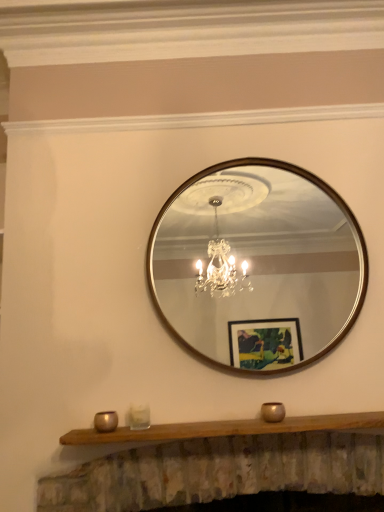
This screenshot has width=384, height=512. What are the coordinates of `clear glass candle holder at lower center, which is counted as the 2th candle holder, starting from the right` in the screenshot? It's located at (139, 417).

What do you see at coordinates (257, 266) in the screenshot? This screenshot has height=512, width=384. I see `wooden-framed mirror at center` at bounding box center [257, 266].

This screenshot has height=512, width=384. Find the location of `gold metallic candle holder at lower center, the first candle holder when ordered from right to left`. gold metallic candle holder at lower center, the first candle holder when ordered from right to left is located at coordinates tap(273, 412).

What is the approximate height of wooden mantle at center?

1.50 inches.

Where is `clear glass candle holder at lower center, which appears as the second candle holder when viewed from the left`? The image size is (384, 512). clear glass candle holder at lower center, which appears as the second candle holder when viewed from the left is located at coordinates (139, 417).

Looking at this image, between wooden mantle at center and gold metallic candle holder at lower center, marked as the third candle holder in a left-to-right arrangement, which one has larger size?

Bigger between the two is wooden mantle at center.

How different are the orientations of wooden mantle at center and gold metallic candle holder at lower center, marked as the third candle holder in a left-to-right arrangement, in degrees?

0.375 degrees.

Does wooden mantle at center have a lesser height compared to gold metallic candle holder at lower center, the first candle holder when ordered from right to left?

Indeed, wooden mantle at center has a lesser height compared to gold metallic candle holder at lower center, the first candle holder when ordered from right to left.

Is wooden mantle at center completely or partially outside of gold metallic candle holder at lower center, the first candle holder when ordered from right to left?

Indeed, wooden mantle at center is completely outside gold metallic candle holder at lower center, the first candle holder when ordered from right to left.

Looking at this image, which of these two, metallic gold candle holder at lower center, arranged as the third candle holder when viewed from the right, or clear glass candle holder at lower center, which appears as the second candle holder when viewed from the left, stands taller?

With more height is clear glass candle holder at lower center, which appears as the second candle holder when viewed from the left.

Is metallic gold candle holder at lower center, arranged as the third candle holder when viewed from the right, completely or partially outside of clear glass candle holder at lower center, which is counted as the 2th candle holder, starting from the right?

Yes, metallic gold candle holder at lower center, arranged as the third candle holder when viewed from the right, is not within clear glass candle holder at lower center, which is counted as the 2th candle holder, starting from the right.

Which object is closer to the camera, metallic gold candle holder at lower center, which is the 1th candle holder in left-to-right order, or clear glass candle holder at lower center, which appears as the second candle holder when viewed from the left?

metallic gold candle holder at lower center, which is the 1th candle holder in left-to-right order.

Is metallic gold candle holder at lower center, which is the 1th candle holder in left-to-right order, aimed at clear glass candle holder at lower center, which is counted as the 2th candle holder, starting from the right?

No, metallic gold candle holder at lower center, which is the 1th candle holder in left-to-right order, is not turned towards clear glass candle holder at lower center, which is counted as the 2th candle holder, starting from the right.

How many degrees apart are the facing directions of clear glass candle holder at lower center, which appears as the second candle holder when viewed from the left, and metallic gold candle holder at lower center, which is the 1th candle holder in left-to-right order?

There is a 1.3-degree angle between the facing directions of clear glass candle holder at lower center, which appears as the second candle holder when viewed from the left, and metallic gold candle holder at lower center, which is the 1th candle holder in left-to-right order.

From a real-world perspective, which is physically above, clear glass candle holder at lower center, which appears as the second candle holder when viewed from the left, or metallic gold candle holder at lower center, which is the 1th candle holder in left-to-right order?

clear glass candle holder at lower center, which appears as the second candle holder when viewed from the left.

Is clear glass candle holder at lower center, which appears as the second candle holder when viewed from the left, further to camera compared to metallic gold candle holder at lower center, which is the 1th candle holder in left-to-right order?

That is True.

Measure the distance between clear glass candle holder at lower center, which is counted as the 2th candle holder, starting from the right, and metallic gold candle holder at lower center, arranged as the third candle holder when viewed from the right.

The distance of clear glass candle holder at lower center, which is counted as the 2th candle holder, starting from the right, from metallic gold candle holder at lower center, arranged as the third candle holder when viewed from the right, is 3.14 inches.

Is wooden mantle at center directly adjacent to metallic gold candle holder at lower center, which is the 1th candle holder in left-to-right order?

wooden mantle at center and metallic gold candle holder at lower center, which is the 1th candle holder in left-to-right order, are clearly separated.

Is point (129, 437) closer to camera compared to point (108, 425)?

Yes, point (129, 437) is closer to viewer.

From a real-world perspective, which is physically below, wooden mantle at center or metallic gold candle holder at lower center, which is the 1th candle holder in left-to-right order?

wooden mantle at center.

Can you confirm if wooden mantle at center is shorter than metallic gold candle holder at lower center, which is the 1th candle holder in left-to-right order?

Yes.

Who is taller, metallic gold candle holder at lower center, arranged as the third candle holder when viewed from the right, or wooden-framed mirror at center?

Standing taller between the two is wooden-framed mirror at center.

Can you tell me how much metallic gold candle holder at lower center, which is the 1th candle holder in left-to-right order, and wooden-framed mirror at center differ in facing direction?

1.58 degrees separate the facing orientations of metallic gold candle holder at lower center, which is the 1th candle holder in left-to-right order, and wooden-framed mirror at center.

From the image's perspective, is metallic gold candle holder at lower center, which is the 1th candle holder in left-to-right order, on top of wooden-framed mirror at center?

No.

Can wooden-framed mirror at center be found inside metallic gold candle holder at lower center, which is the 1th candle holder in left-to-right order?

Definitely not — wooden-framed mirror at center is not inside metallic gold candle holder at lower center, which is the 1th candle holder in left-to-right order.

From the image's perspective, which object appears higher, gold metallic candle holder at lower center, the first candle holder when ordered from right to left, or metallic gold candle holder at lower center, which is the 1th candle holder in left-to-right order?

gold metallic candle holder at lower center, the first candle holder when ordered from right to left.

Is gold metallic candle holder at lower center, marked as the third candle holder in a left-to-right arrangement, not close to metallic gold candle holder at lower center, which is the 1th candle holder in left-to-right order?

gold metallic candle holder at lower center, marked as the third candle holder in a left-to-right arrangement, is actually quite close to metallic gold candle holder at lower center, which is the 1th candle holder in left-to-right order.

Is gold metallic candle holder at lower center, the first candle holder when ordered from right to left, not within metallic gold candle holder at lower center, arranged as the third candle holder when viewed from the right?

Yes, gold metallic candle holder at lower center, the first candle holder when ordered from right to left, is outside of metallic gold candle holder at lower center, arranged as the third candle holder when viewed from the right.

Considering the sizes of objects clear glass candle holder at lower center, which appears as the second candle holder when viewed from the left, and gold metallic candle holder at lower center, the first candle holder when ordered from right to left, in the image provided, who is bigger, clear glass candle holder at lower center, which appears as the second candle holder when viewed from the left, or gold metallic candle holder at lower center, the first candle holder when ordered from right to left,?

gold metallic candle holder at lower center, the first candle holder when ordered from right to left.

There is a gold metallic candle holder at lower center, marked as the third candle holder in a left-to-right arrangement. What are the coordinates of `the 1st candle holder below it (from the image's perspective)` in the screenshot? It's located at (139, 417).

From a real-world perspective, is clear glass candle holder at lower center, which is counted as the 2th candle holder, starting from the right, physically located above or below gold metallic candle holder at lower center, marked as the third candle holder in a left-to-right arrangement?

clear glass candle holder at lower center, which is counted as the 2th candle holder, starting from the right, is situated higher than gold metallic candle holder at lower center, marked as the third candle holder in a left-to-right arrangement, in the real world.

Does clear glass candle holder at lower center, which appears as the second candle holder when viewed from the left, come in front of gold metallic candle holder at lower center, marked as the third candle holder in a left-to-right arrangement?

No, the depth of clear glass candle holder at lower center, which appears as the second candle holder when viewed from the left, is greater than that of gold metallic candle holder at lower center, marked as the third candle holder in a left-to-right arrangement.

I want to click on mantle below the gold metallic candle holder at lower center, marked as the third candle holder in a left-to-right arrangement (from a real-world perspective), so click(226, 429).

Which candle holder is the 1st one when counting from the right side of the metallic gold candle holder at lower center, arranged as the third candle holder when viewed from the right? Please provide its 2D coordinates.

[(139, 417)]

Looking at the image, which one is located further to metallic gold candle holder at lower center, arranged as the third candle holder when viewed from the right, gold metallic candle holder at lower center, the first candle holder when ordered from right to left, or wooden mantle at center?

gold metallic candle holder at lower center, the first candle holder when ordered from right to left, lies further to metallic gold candle holder at lower center, arranged as the third candle holder when viewed from the right, than the other object.

When comparing their distances from wooden mantle at center, does clear glass candle holder at lower center, which is counted as the 2th candle holder, starting from the right, or gold metallic candle holder at lower center, marked as the third candle holder in a left-to-right arrangement, seem further?

clear glass candle holder at lower center, which is counted as the 2th candle holder, starting from the right, is positioned further to the anchor wooden mantle at center.

Based on their spatial positions, is clear glass candle holder at lower center, which is counted as the 2th candle holder, starting from the right, or wooden mantle at center closer to metallic gold candle holder at lower center, arranged as the third candle holder when viewed from the right?

clear glass candle holder at lower center, which is counted as the 2th candle holder, starting from the right, is positioned closer to the anchor metallic gold candle holder at lower center, arranged as the third candle holder when viewed from the right.

Which object lies nearer to the anchor point wooden-framed mirror at center, gold metallic candle holder at lower center, marked as the third candle holder in a left-to-right arrangement, or clear glass candle holder at lower center, which is counted as the 2th candle holder, starting from the right?

The object closer to wooden-framed mirror at center is gold metallic candle holder at lower center, marked as the third candle holder in a left-to-right arrangement.

From the image, which object appears to be nearer to gold metallic candle holder at lower center, the first candle holder when ordered from right to left, clear glass candle holder at lower center, which appears as the second candle holder when viewed from the left, or metallic gold candle holder at lower center, which is the 1th candle holder in left-to-right order?

Among the two, clear glass candle holder at lower center, which appears as the second candle holder when viewed from the left, is located nearer to gold metallic candle holder at lower center, the first candle holder when ordered from right to left.

Estimate the real-world distances between objects in this image. Which object is closer to clear glass candle holder at lower center, which appears as the second candle holder when viewed from the left, wooden-framed mirror at center or metallic gold candle holder at lower center, which is the 1th candle holder in left-to-right order?

Among the two, metallic gold candle holder at lower center, which is the 1th candle holder in left-to-right order, is located nearer to clear glass candle holder at lower center, which appears as the second candle holder when viewed from the left.

Which object lies further to the anchor point wooden mantle at center, metallic gold candle holder at lower center, arranged as the third candle holder when viewed from the right, or gold metallic candle holder at lower center, marked as the third candle holder in a left-to-right arrangement?

Based on the image, metallic gold candle holder at lower center, arranged as the third candle holder when viewed from the right, appears to be further to wooden mantle at center.

Looking at the image, which one is located further to wooden-framed mirror at center, clear glass candle holder at lower center, which is counted as the 2th candle holder, starting from the right, or wooden mantle at center?

clear glass candle holder at lower center, which is counted as the 2th candle holder, starting from the right, is further to wooden-framed mirror at center.

This screenshot has height=512, width=384. Identify the location of mirror between metallic gold candle holder at lower center, arranged as the third candle holder when viewed from the right, and gold metallic candle holder at lower center, the first candle holder when ordered from right to left, from left to right. (257, 266).

The height and width of the screenshot is (512, 384). In order to click on candle holder between metallic gold candle holder at lower center, which is the 1th candle holder in left-to-right order, and wooden mantle at center, in the horizontal direction in this screenshot , I will do `click(139, 417)`.

Identify the location of mantle between clear glass candle holder at lower center, which is counted as the 2th candle holder, starting from the right, and gold metallic candle holder at lower center, marked as the third candle holder in a left-to-right arrangement, from left to right. (226, 429).

Find the location of a particular element. This screenshot has width=384, height=512. candle holder between wooden-framed mirror at center and clear glass candle holder at lower center, which appears as the second candle holder when viewed from the left, from top to bottom is located at coordinates (273, 412).